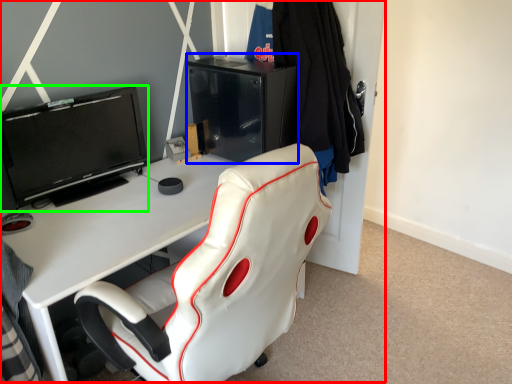
Question: Which object is the farthest from entertainment center (highlighted by a red box)? Choose among these: file cabinet (highlighted by a blue box) or television (highlighted by a green box).

Choices:
 (A) file cabinet
 (B) television

Answer: (B)